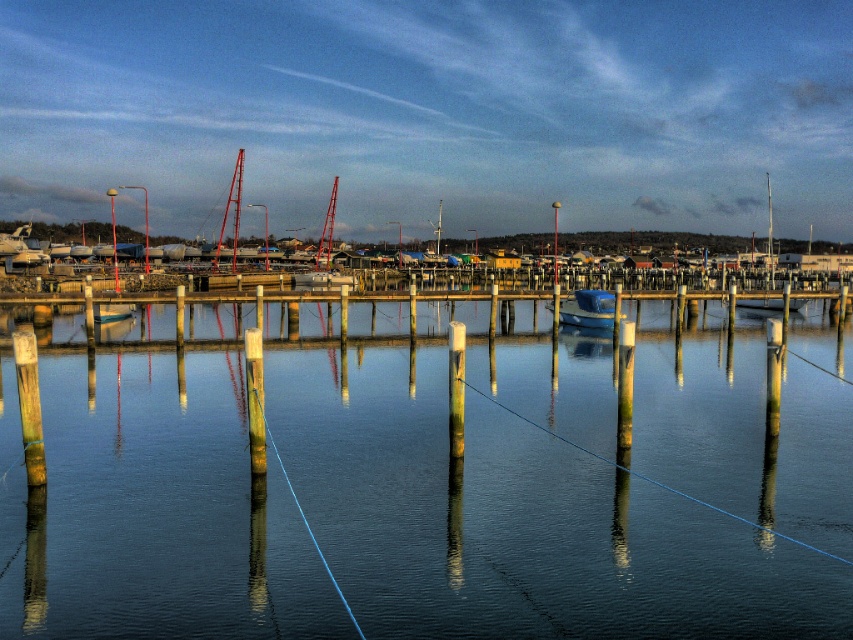
Question: Which point is closer to the camera?

Choices:
 (A) (109, 312)
 (B) (770, 268)
 (C) (325, 218)
 (D) (566, 301)

Answer: (A)

Question: Is smooth wooden post at left in front of green wood post at center?

Choices:
 (A) no
 (B) yes

Answer: (B)

Question: Based on their relative distances, which object is farther from the green wood post at center?

Choices:
 (A) smooth wooden post at left
 (B) wooden post at center
 (C) metallic red mast at center

Answer: (C)

Question: Is metallic mast at center thinner than metallic pole at center?

Choices:
 (A) yes
 (B) no

Answer: (A)

Question: Is wooden post at center positioned in front of blue matte boat at center?

Choices:
 (A) yes
 (B) no

Answer: (A)

Question: Which object appears farthest from the camera in this image?

Choices:
 (A) metallic pole at center
 (B) green wood post at center
 (C) smooth wooden post at left
 (D) blue glossy boat at center

Answer: (A)